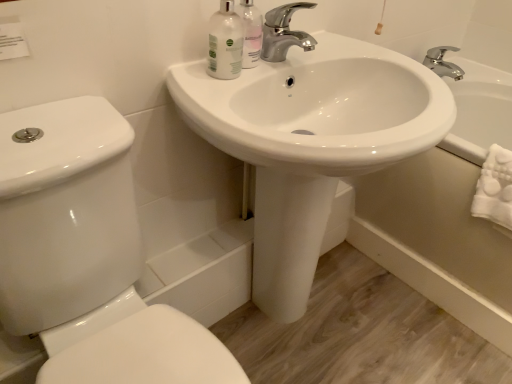
This screenshot has width=512, height=384. In order to click on vacant space underneath white glossy sink at center (from a real-world perspective) in this screenshot , I will do `click(312, 324)`.